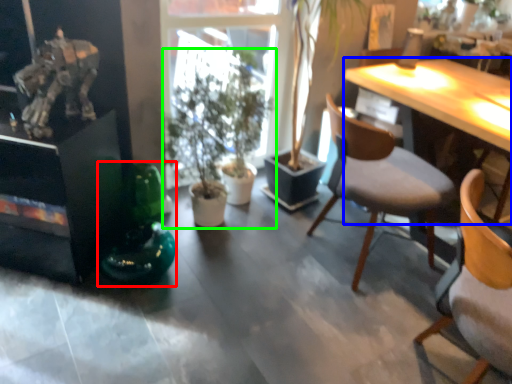
Question: Which object is positioned closest to toy (highlighted by a red box)? Select from desk (highlighted by a blue box) and houseplant (highlighted by a green box).

Choices:
 (A) desk
 (B) houseplant

Answer: (B)